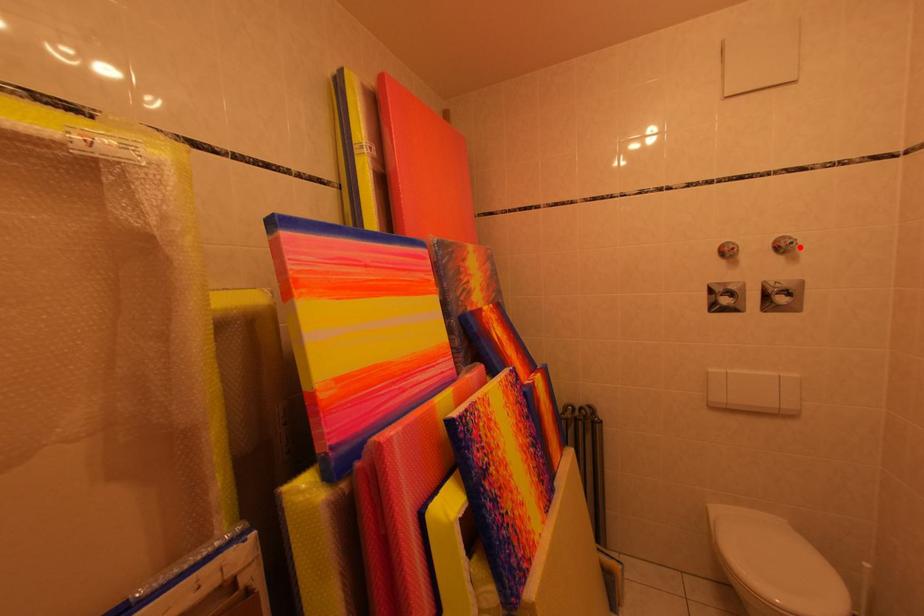
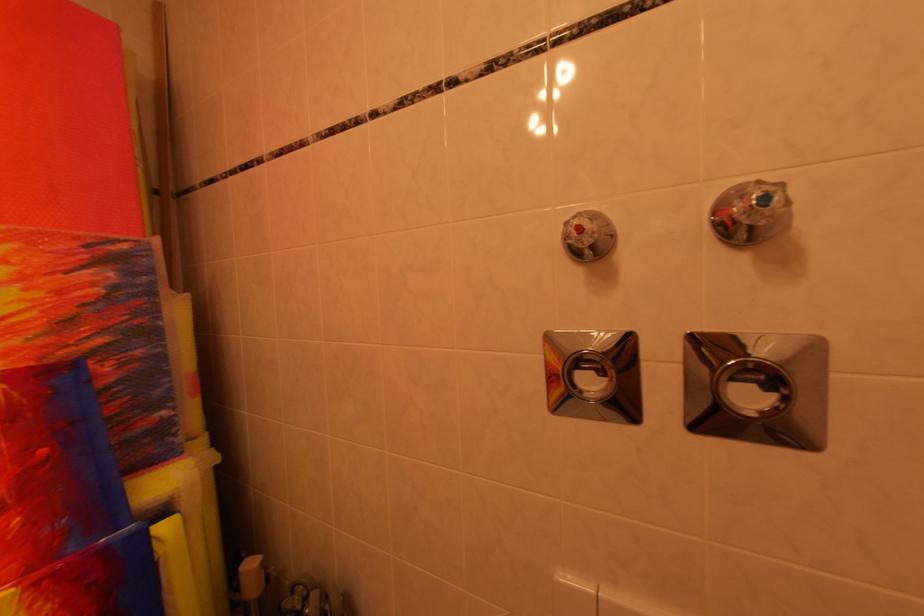
The point at the highlighted location is marked in the first image. Where is the corresponding point in the second image?

(773, 201)